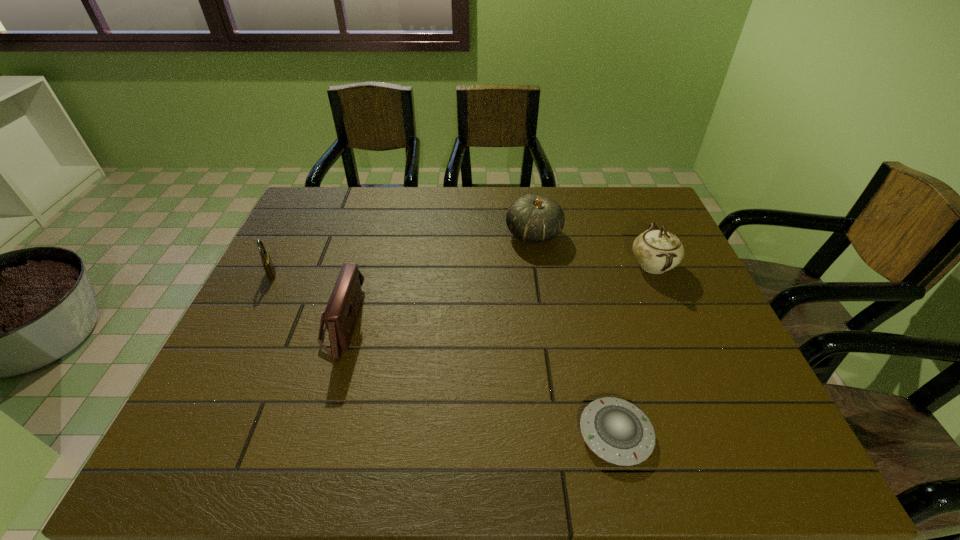
You are a GUI agent. You are given a task and a screenshot of the screen. Output one action in this format:
    pyautogui.click(x=<x>, y=<y>)
    Task: Click on the vacant space located on the right of the nearest object
    This screenshot has width=960, height=540.
    Given the screenshot: What is the action you would take?
    pyautogui.click(x=727, y=434)

Locate an element on the screen. This screenshot has width=960, height=540. object located in the far edge section of the desktop is located at coordinates (533, 219).

Image resolution: width=960 pixels, height=540 pixels. I want to click on object present at the near edge, so click(612, 428).

Identify the location of object located in the left edge section of the desktop. This screenshot has width=960, height=540. (267, 263).

The image size is (960, 540). Find the location of `object that is at the right edge`. object that is at the right edge is located at coordinates (657, 251).

You are a GUI agent. You are given a task and a screenshot of the screen. Output one action in this format:
    pyautogui.click(x=<x>, y=<y>)
    Task: Click on the free spot at the far edge of the desktop
    This screenshot has width=960, height=540.
    Given the screenshot: What is the action you would take?
    pyautogui.click(x=505, y=190)

In the image, there is a desktop. At what (x,y) coordinates should I click in order to perform the action: click on free region at the near edge. Please return your answer as a coordinate pair (x, y). This screenshot has width=960, height=540. Looking at the image, I should click on (267, 444).

The height and width of the screenshot is (540, 960). In the image, there is a desktop. Identify the location of free region at the left edge. (338, 236).

Identify the location of vacant region at the right edge. The height and width of the screenshot is (540, 960). (720, 349).

Identify the location of free region at the far right corner of the desktop. The image size is (960, 540). (629, 202).